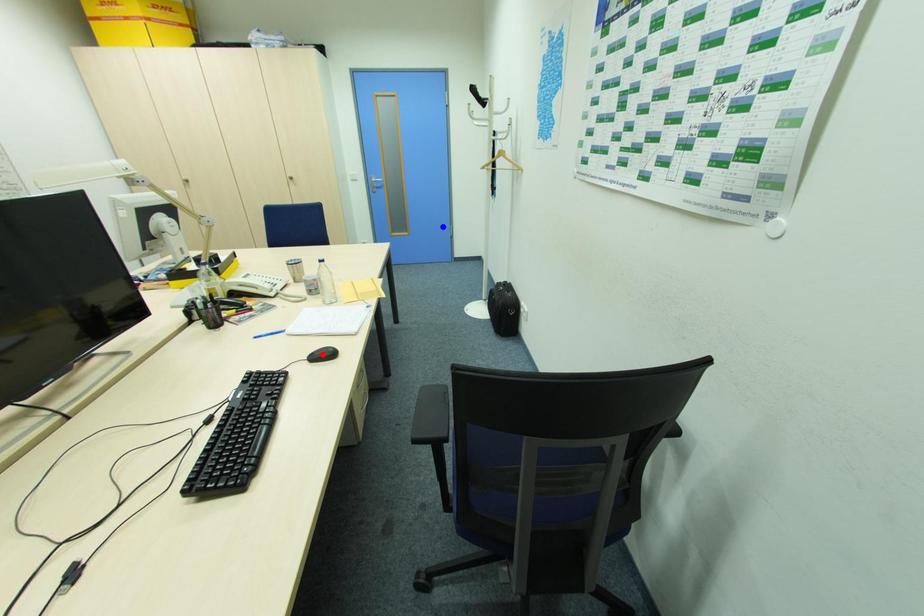
Question: In the image, two points are highlighted. Which point is nearer to the camera? Reply with the corresponding letter.

Choices:
 (A) blue point
 (B) red point

Answer: (B)